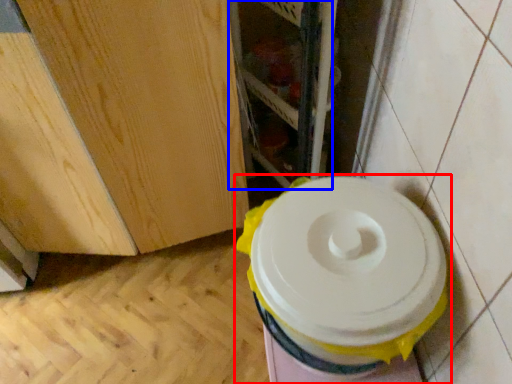
Question: Which of the following is the closest to the observer, toilet (highlighted by a red box) or shelf (highlighted by a blue box)?

Choices:
 (A) toilet
 (B) shelf

Answer: (A)